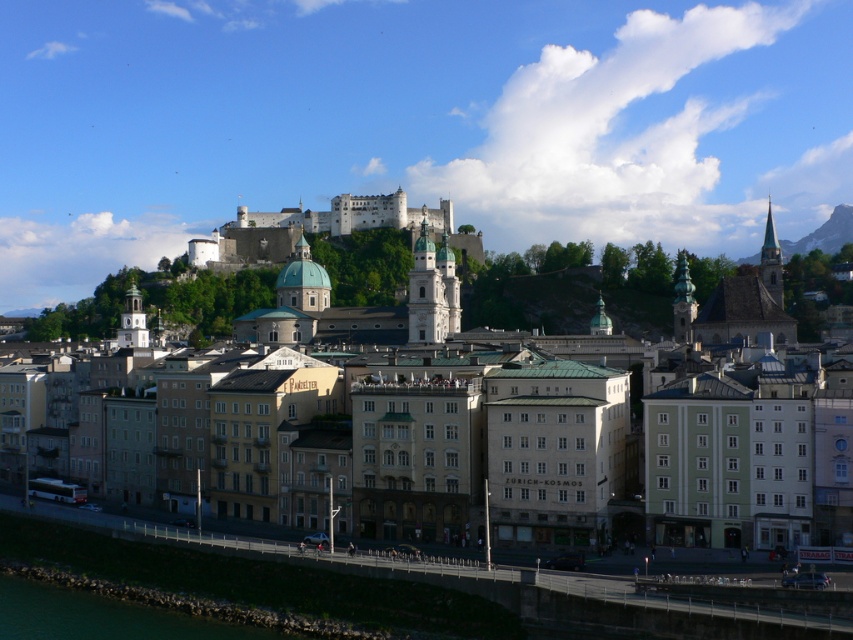
In the scene shown: You are standing at the point marked as point (323, 228) in the image. What landmark are you currently located on?

You are located on the white stone castle at upper center.

You are standing on the walkway and want to take a photo of the matte stone buildings at center and the green stone wall at lower left. Which object should you focus on first if you want to capture both in one frame without moving your camera?

The matte stone buildings at center is positioned on the right side of green stone wall at lower left, so you should focus on the green stone wall at lower left first to ensure both are in the frame.